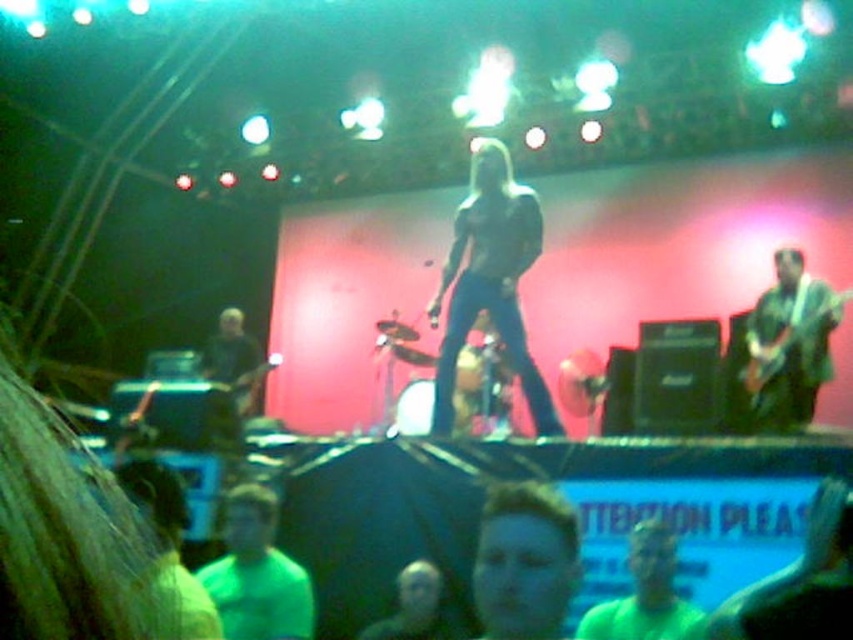
You are a photographer at the concert and want to capture a photo where both the shiny black guitar at center and the shiny green guitar at right are visible. Based on their positions, which guitar should you focus on to ensure both are in frame?

The shiny black guitar at center is positioned on the left side of the shiny green guitar at right, so focusing on the shiny green guitar at right would ensure both guitars are visible in the frame since it is positioned to the right of the shiny black guitar at center.

You are a stagehand who needs to place a 1.2 meter wide amplifier between the shiny black guitar at center and the shiny green guitar at right. Can the amplifier fit between them based on their widths?

The shiny black guitar at center is wider than the shiny green guitar at right. However, the total width of both guitars combined would need to be considered to determine if there is enough space. Since the amplifier is 1.2 meters wide, but we only know the relative sizes of the guitars, not their actual dimensions, it is impossible to accurately determine if the amplifier will fit without additional measurements.